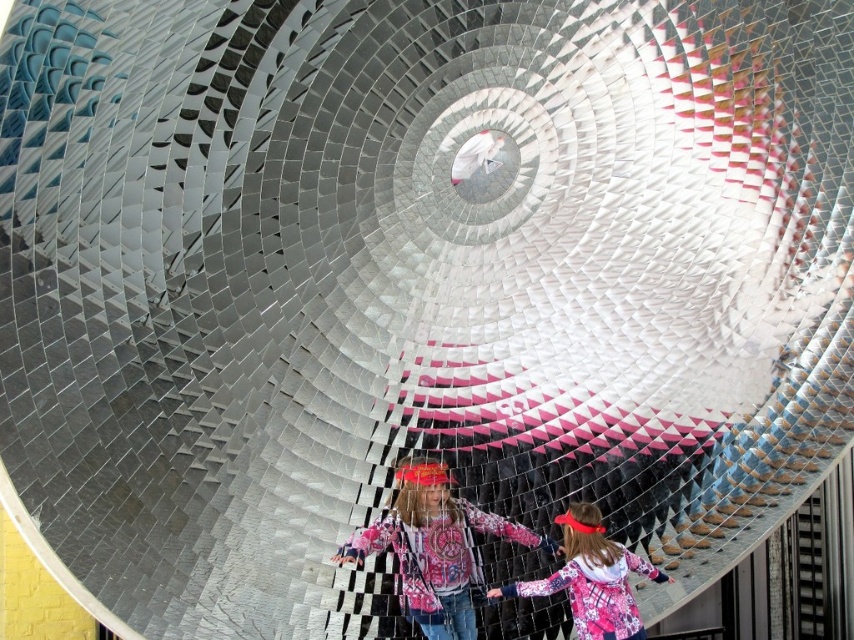
You are standing at the entrance of the circular structure and want to locate the plaid fabric shirt at center. According to the coordinates given, in which direction should you look to find it?

The plaid fabric shirt at center is located at coordinates point (436,548), which means it is positioned to the right of the center point along the horizontal axis. So you should look to your right from the entrance to find it.

You are a tour guide leading a group through this reflective circular structure. You notice two visitors wearing plaid fabric shirt at center and plaid fabric hoodie at center. If you want to ensure all your group members can see both visitors clearly, what is the minimum width of the path you should designate between the two visitors?

The minimum width of the path should be at least 4.71 meters to ensure all group members can see both the plaid fabric shirt at center and the plaid fabric hoodie at center clearly.